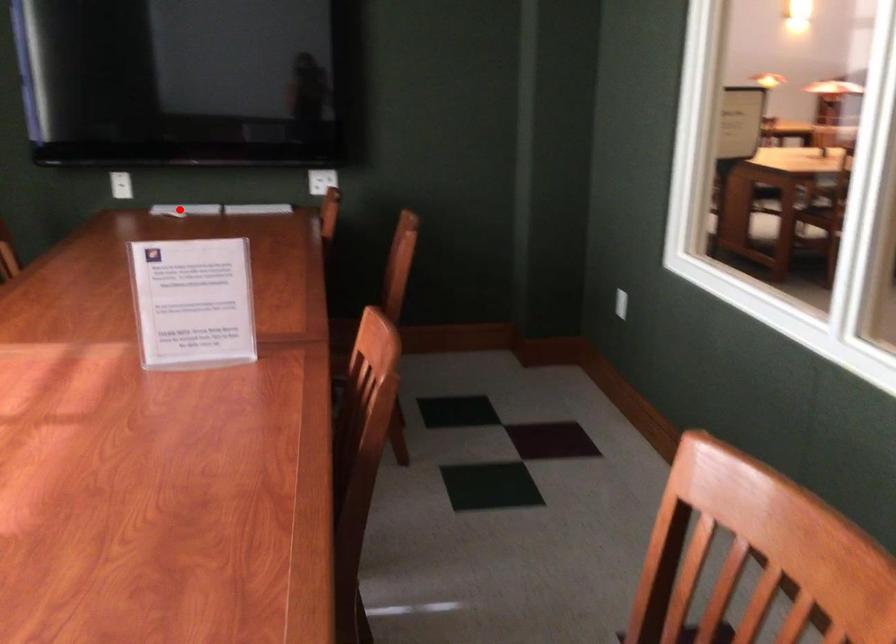
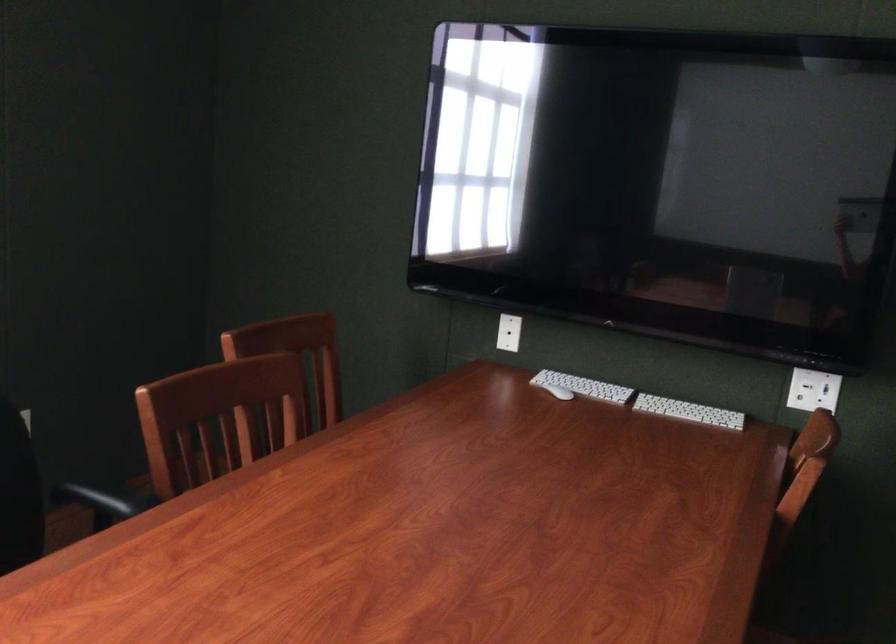
The point at the highlighted location is marked in the first image. Where is the corresponding point in the second image?

(558, 392)